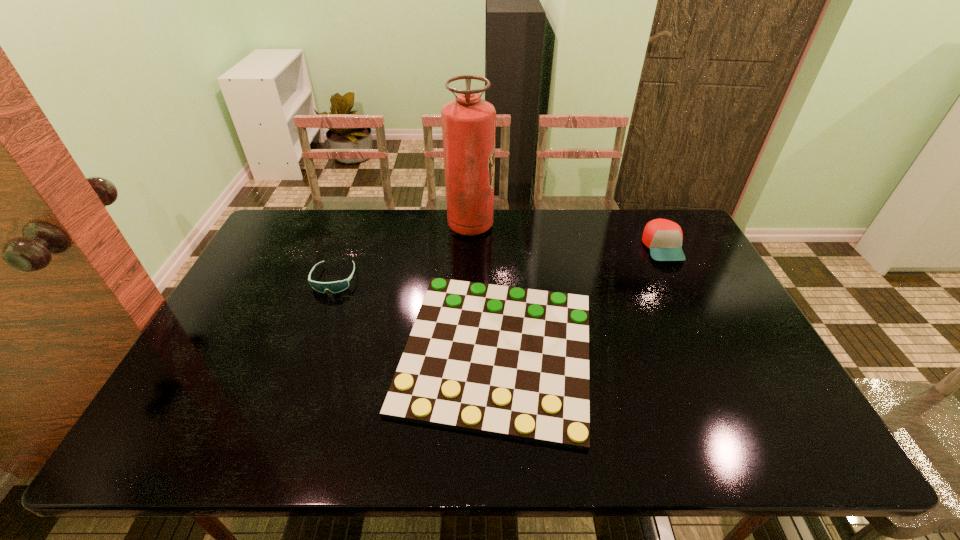
You are a GUI agent. You are given a task and a screenshot of the screen. Output one action in this format:
    pyautogui.click(x=<x>, y=<y>)
    Task: Click on the fire extinguisher that is at the far edge
    Image resolution: width=960 pixels, height=540 pixels.
    Given the screenshot: What is the action you would take?
    pyautogui.click(x=468, y=123)

The width and height of the screenshot is (960, 540). Find the location of `baseball cap situated at the far edge`. baseball cap situated at the far edge is located at coordinates (663, 237).

At what (x,y) coordinates should I click in order to perform the action: click on object situated at the near edge. Please return your answer as a coordinate pair (x, y). Looking at the image, I should click on (512, 362).

Identify the location of object situated at the right edge. The image size is (960, 540). (663, 237).

Find the location of a particular element. The width and height of the screenshot is (960, 540). object located in the far right corner section of the desktop is located at coordinates (663, 237).

Locate an element on the screen. vacant point at the far edge is located at coordinates (625, 228).

Find the location of a particular element. This screenshot has width=960, height=540. free space at the left edge of the desktop is located at coordinates (270, 301).

Locate an element on the screen. This screenshot has width=960, height=540. vacant area at the right edge of the desktop is located at coordinates tap(699, 269).

You are a GUI agent. You are given a task and a screenshot of the screen. Output one action in this format:
    pyautogui.click(x=<x>, y=<y>)
    Task: Click on the vacant space at the near left corner
    
    Given the screenshot: What is the action you would take?
    pyautogui.click(x=187, y=421)

The height and width of the screenshot is (540, 960). I want to click on free space between the fire extinguisher and the baseball cap, so click(x=566, y=237).